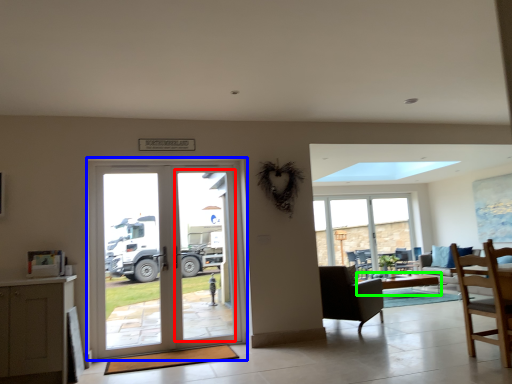
Question: Based on their relative distances, which object is nearer to screen door (highlighted by a red box)? Choose from door (highlighted by a blue box) and table (highlighted by a green box).

Choices:
 (A) door
 (B) table

Answer: (A)